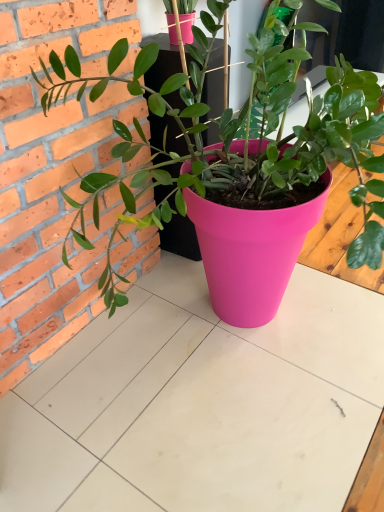
Question: Visually, is matte pink pot at center positioned to the left or to the right of matte pink pot at center?

Choices:
 (A) right
 (B) left

Answer: (B)

Question: Considering the positions of matte pink pot at center and matte pink pot at center in the image, is matte pink pot at center wider or thinner than matte pink pot at center?

Choices:
 (A) wide
 (B) thin

Answer: (B)

Question: Is point (97, 92) closer or farther from the camera than point (84, 333)?

Choices:
 (A) farther
 (B) closer

Answer: (B)

Question: Is point (46, 415) positioned closer to the camera than point (344, 162)?

Choices:
 (A) closer
 (B) farther

Answer: (B)

Question: From the image's perspective, is matte pink pot at center located above or below matte pink pot at center?

Choices:
 (A) above
 (B) below

Answer: (B)

Question: From a real-world perspective, is matte pink pot at center physically located above or below matte pink pot at center?

Choices:
 (A) below
 (B) above

Answer: (A)

Question: Visually, is matte pink pot at center positioned to the left or to the right of matte pink pot at center?

Choices:
 (A) right
 (B) left

Answer: (A)